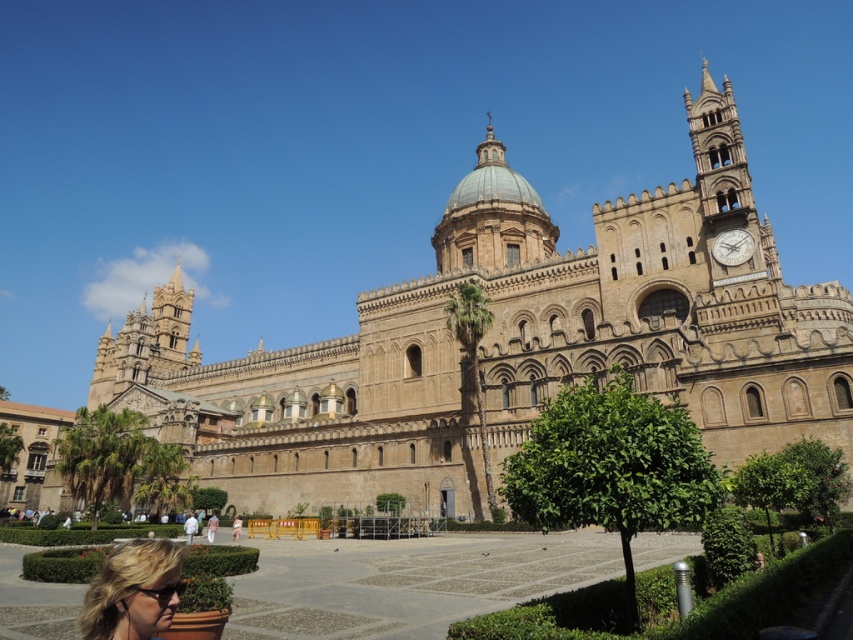
You are standing in front of the cathedral and want to take a photo. You notice two points marked on the ground at coordinates point [422,369] and point [115,620]. Which point is closer to you?

Point [422,369] is further to the viewer than point [115,620], so the point closer to you is point [115,620].

You are standing in front of the brown stone church at center and the pink fabric dress at lower center. Which object is closer to you?

The brown stone church at center is closer to you because it is in front of the pink fabric dress at lower center.